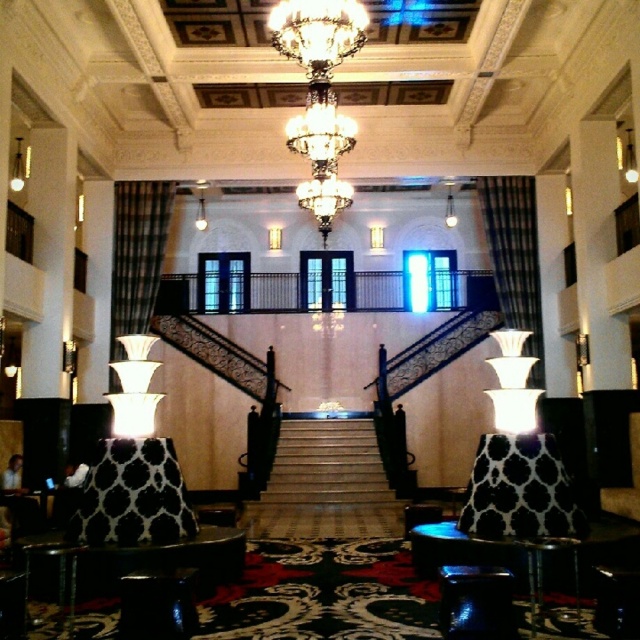
You are a hotel manager planning to place a new rectangular table in the lobby. The table is 2 meters wide. You see the crystal glass chandelier at center and the black wrought iron staircase at center. Which object can the table fit next to without overlapping?

The table can fit next to the crystal glass chandelier at center because it occupies less space than the black wrought iron staircase at center, making it easier to place the table there without overlapping.

You are a guest entering the grand building and want to take the stairs to the mezzanine level. Since you have a heavy suitcase, you need to choose between the white marble stairs at center and the black wrought iron staircase at center. Which one is on the left side and thus closer to you?

The white marble stairs at center is positioned on the left side of the black wrought iron staircase at center, so it is closer to you.

You are a guest entering the grand building and want to locate the stairs. Since you can see both the crystal glass chandelier at center and the white marble stairs at center from your current position, which object should you look towards to find the stairs?

The crystal glass chandelier at center is located above the white marble stairs at center, so you should look towards the crystal glass chandelier at center to find the stairs since it is positioned above them.